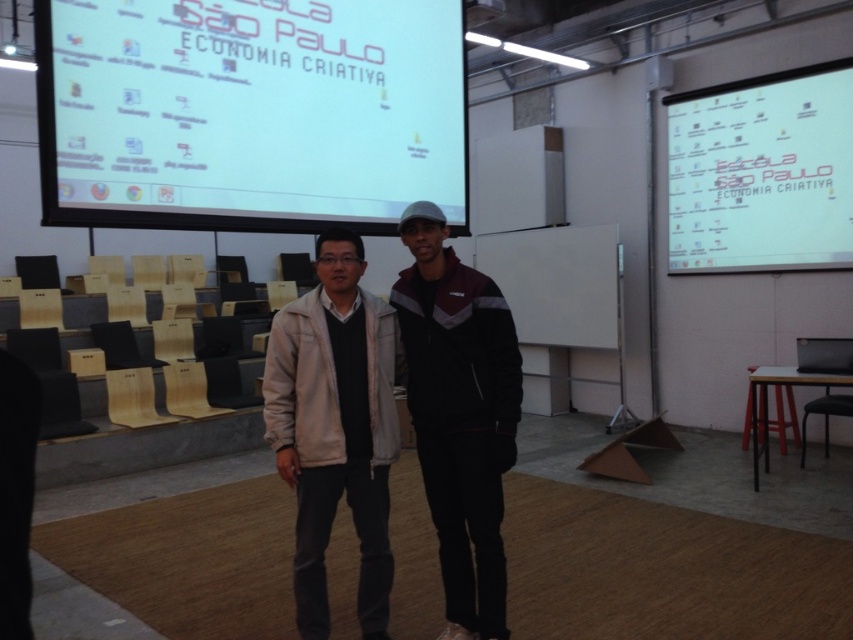
Looking at this image, you are standing in the lecture hall and need to locate the white matte projector screen at upper center. Based on the coordinates provided, where exactly should you look to find it?

The white matte projector screen at upper center is located at coordinates point (248, 113).

You are an event organizer who needs to display a presentation. The white matte projector screen at upper center and the white paper at upper right are both available. Which one would be more suitable for showing a large presentation to the audience?

The white matte projector screen at upper center is more suitable because it has a larger size compared to the white paper at upper right, making it easier to view from a distance.

You are standing in the lecture hall and want to determine which of the two points, point (317, 253) or point (698, 257), is nearer to you. Based on the scene description, which point is closer?

Point (317, 253) is closer to the viewer than point (698, 257).